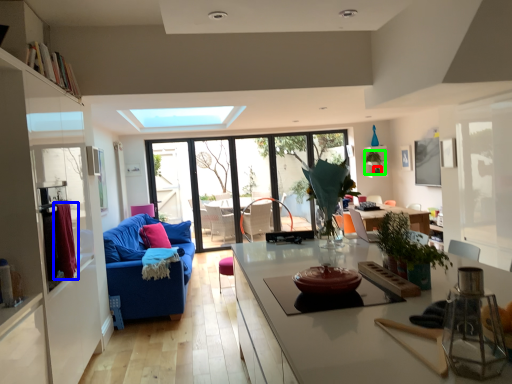
Question: Considering the real-world distances, which object is closest to plant (highlighted by a red box)? curtain (highlighted by a blue box) or plant (highlighted by a green box).

Choices:
 (A) curtain
 (B) plant

Answer: (B)